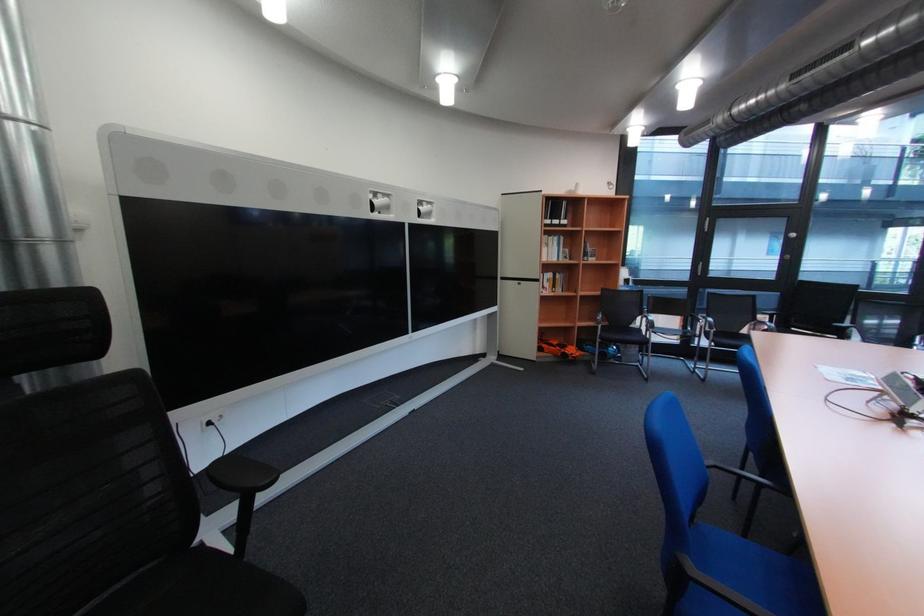
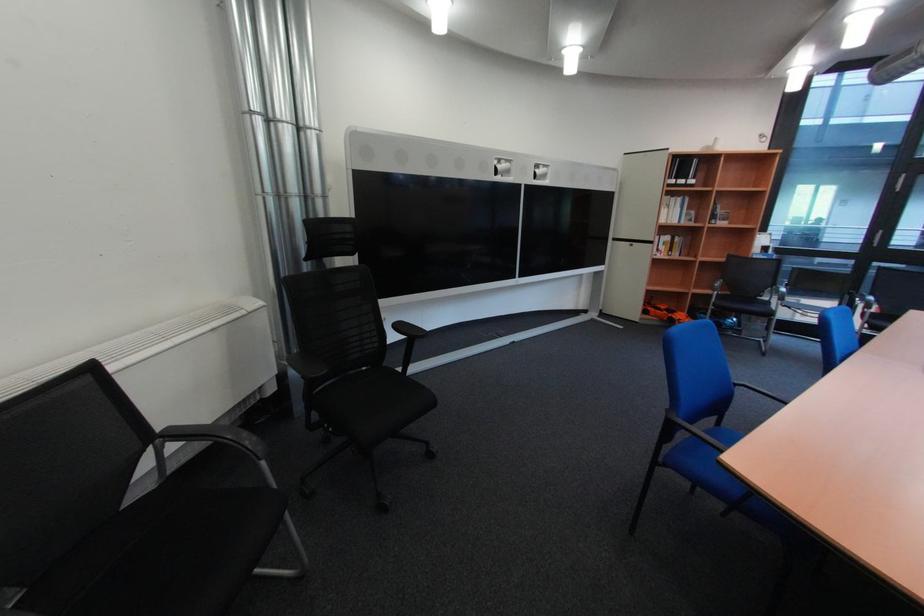
Question: The images are taken continuously from a first-person perspective. In which direction are you moving?

Choices:
 (A) Left
 (B) Right
 (C) Forward
 (D) Backward

Answer: (D)